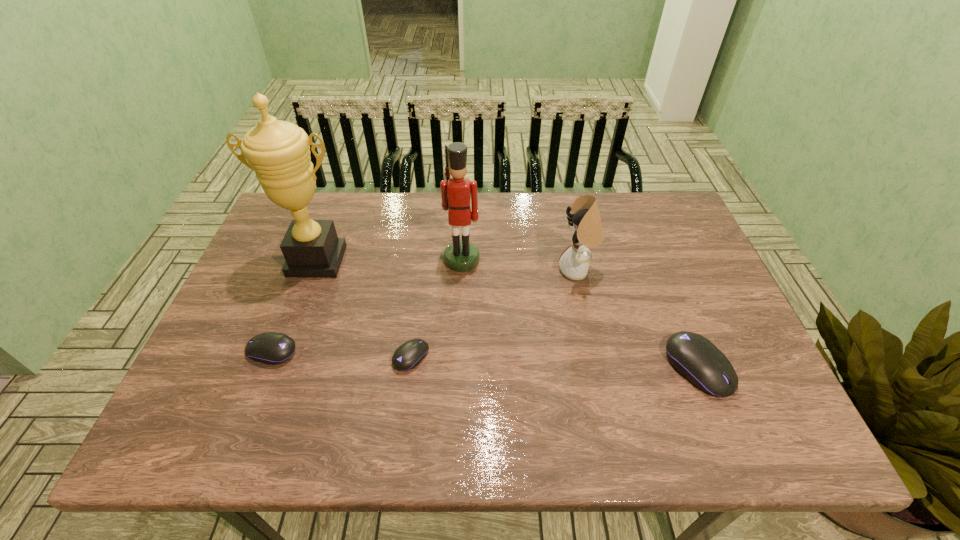
Where is `the tallest object`? the tallest object is located at coordinates click(278, 152).

Identify the location of free spot located on the front of the leftmost computer mouse. (253, 398).

Where is `free space located 0.400m on the right of the second computer mouse from left to right`? This screenshot has width=960, height=540. free space located 0.400m on the right of the second computer mouse from left to right is located at coordinates (598, 356).

Identify the location of vacant space located 0.290m on the back of the tallest computer mouse. The width and height of the screenshot is (960, 540). (655, 258).

Locate an element on the screen. This screenshot has height=540, width=960. vacant region located at the front face of the third tallest object is located at coordinates (427, 270).

Identify the location of vacant region located 0.140m at the front face of the third tallest object. (509, 270).

Identify the location of free space located 0.320m at the front face of the third tallest object. (444, 270).

What are the coordinates of `free space located on the front-facing side of the fourth object from left to right` in the screenshot? It's located at (460, 299).

Find the location of a particular element. Image resolution: width=960 pixels, height=540 pixels. free space located 0.280m at the front of the tallest object with handles is located at coordinates click(x=278, y=367).

This screenshot has height=540, width=960. What are the coordinates of `computer mouse at the left edge` in the screenshot? It's located at (270, 347).